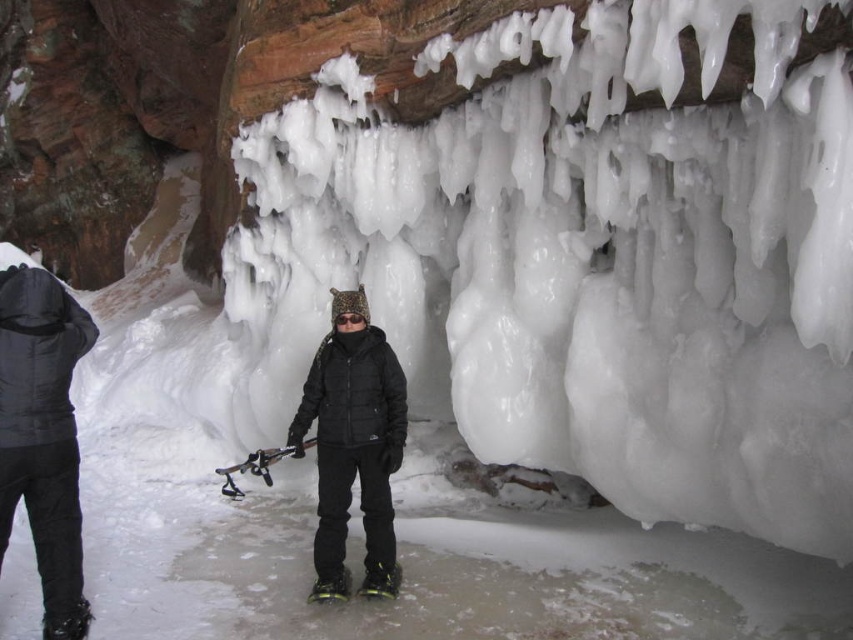
You are a photographer trying to capture the winter scene with both the black matte jacket at left and the black matte jacket at center in the frame. Which jacket should you focus on to ensure the other is fully visible in the background?

The black matte jacket at left is shorter than the black matte jacket at center. To ensure the taller jacket at center is fully visible in the background, focus on the shorter jacket at left.